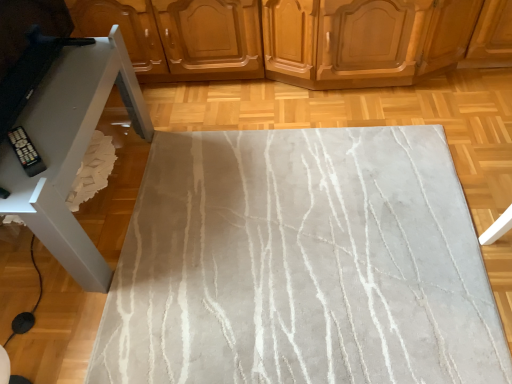
Question: Should I look upward or downward to see white glossy tv stand at left?

Choices:
 (A) down
 (B) up

Answer: (B)